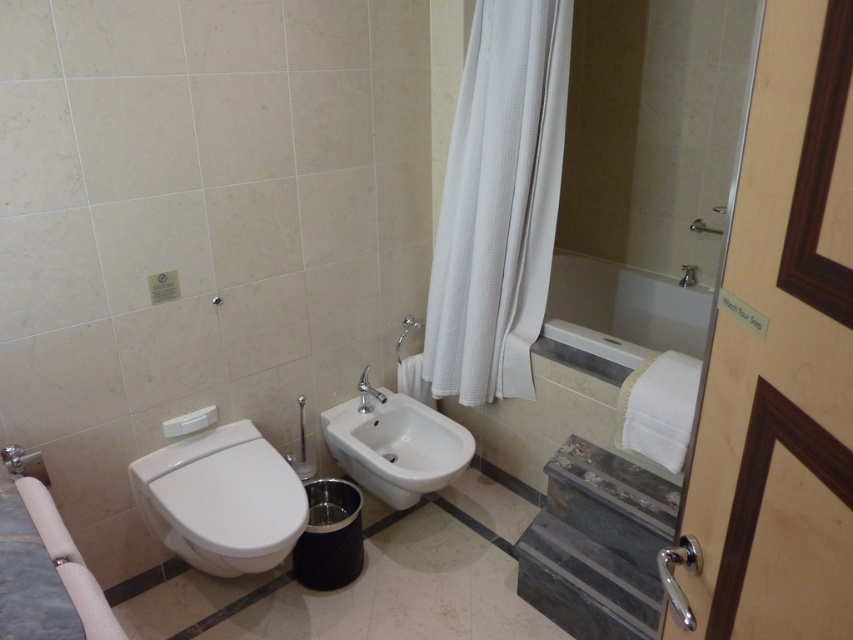
Question: Among these objects, which one is farthest from the camera?

Choices:
 (A) white glossy bathtub at center
 (B) white waffle-textured curtain at center-right
 (C) white glossy bidet at lower left
 (D) white glossy sink at center

Answer: (A)

Question: Is white glossy bidet at lower left smaller than white glossy sink at center?

Choices:
 (A) yes
 (B) no

Answer: (B)

Question: Does white waffle-textured curtain at center-right appear under white glossy bidet at lower left?

Choices:
 (A) yes
 (B) no

Answer: (B)

Question: Based on their relative distances, which object is nearer to the white glossy bathtub at center?

Choices:
 (A) matte silver faucet at upper center
 (B) white waffle-textured curtain at center-right
 (C) white glossy bidet at lower left
 (D) white glossy sink at center

Answer: (B)

Question: Estimate the real-world distances between objects in this image. Which object is closer to the white glossy bidet at lower left?

Choices:
 (A) matte silver faucet at upper center
 (B) white glossy bathtub at center
 (C) white glossy sink at center

Answer: (C)

Question: Can you confirm if white glossy sink at center is positioned above matte silver faucet at upper center?

Choices:
 (A) no
 (B) yes

Answer: (A)